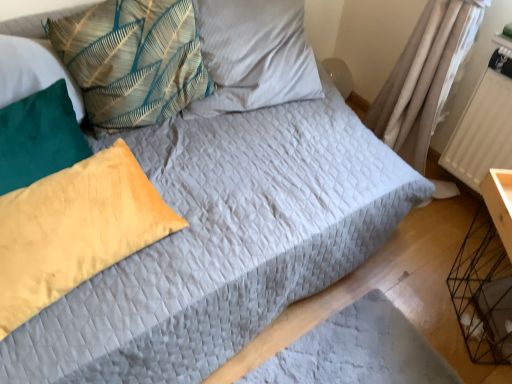
Describe the element at coordinates (482, 132) in the screenshot. The width and height of the screenshot is (512, 384). I see `white textured radiator at right` at that location.

What do you see at coordinates (39, 138) in the screenshot?
I see `yellow cotton pillow at left, positioned as the 2th pillow in bottom-to-top order` at bounding box center [39, 138].

The height and width of the screenshot is (384, 512). In order to click on white textured radiator at right in this screenshot , I will do `click(482, 132)`.

Considering the relative sizes of velvet yellow pillow at left, the 4th pillow when ordered from top to bottom, and yellow cotton pillow at left, the third pillow positioned from the top, in the image provided, is velvet yellow pillow at left, the 4th pillow when ordered from top to bottom, taller than yellow cotton pillow at left, the third pillow positioned from the top,?

In fact, velvet yellow pillow at left, the 4th pillow when ordered from top to bottom, may be shorter than yellow cotton pillow at left, the third pillow positioned from the top.

Which is farther from the camera, (6, 230) or (33, 159)?

Point (33, 159)

Considering the relative sizes of velvet yellow pillow at left, the 4th pillow when ordered from top to bottom, and yellow cotton pillow at left, positioned as the 2th pillow in bottom-to-top order, in the image provided, is velvet yellow pillow at left, the 4th pillow when ordered from top to bottom, bigger than yellow cotton pillow at left, positioned as the 2th pillow in bottom-to-top order,?

Correct, velvet yellow pillow at left, the 4th pillow when ordered from top to bottom, is larger in size than yellow cotton pillow at left, positioned as the 2th pillow in bottom-to-top order.

Does velvet yellow pillow at left, the 4th pillow when ordered from top to bottom, have a greater height compared to white textured radiator at right?

No, velvet yellow pillow at left, the 4th pillow when ordered from top to bottom, is not taller than white textured radiator at right.

Which object is thinner, velvet yellow pillow at left, the 1th pillow ordered from the bottom, or white textured radiator at right?

Thinner between the two is white textured radiator at right.

Consider the image. From a real-world perspective, is velvet yellow pillow at left, the 1th pillow ordered from the bottom, physically located above or below white textured radiator at right?

velvet yellow pillow at left, the 1th pillow ordered from the bottom, is above white textured radiator at right.

Considering their positions, is teal fabric pillow at upper left, which is counted as the 2th pillow, starting from the top, located in front of or behind white textured radiator at right?

Clearly, teal fabric pillow at upper left, which is counted as the 2th pillow, starting from the top, is in front of white textured radiator at right.

From the image's perspective, between teal fabric pillow at upper left, which is counted as the 2th pillow, starting from the top, and white textured radiator at right, who is located below?

white textured radiator at right appears lower in the image.

Does teal fabric pillow at upper left, which is counted as the 2th pillow, starting from the top, have a smaller size compared to white textured radiator at right?

No.

In the scene shown: Is teal fabric pillow at upper left, the third pillow when ordered from bottom to top, next to white textured radiator at right and touching it?

They are not placed beside each other.

Does black wire crate at lower right have a lesser width compared to velvet yellow pillow at left, the 4th pillow when ordered from top to bottom?

In fact, black wire crate at lower right might be wider than velvet yellow pillow at left, the 4th pillow when ordered from top to bottom.

From the image's perspective, which one is positioned higher, black wire crate at lower right or velvet yellow pillow at left, the 1th pillow ordered from the bottom?

velvet yellow pillow at left, the 1th pillow ordered from the bottom, appears higher in the image.

Which is more distant, (x=509, y=287) or (x=104, y=230)?

The point (x=509, y=287) is more distant.

Does black wire crate at lower right have a greater height compared to velvet yellow pillow at left, the 1th pillow ordered from the bottom?

Yes, black wire crate at lower right is taller than velvet yellow pillow at left, the 1th pillow ordered from the bottom.

Locate an element on the screen. This screenshot has height=384, width=512. the 1st pillow to the left of the textured fabric pillow at upper center, which ranks as the 4th pillow in bottom-to-top order, starting your count from the anchor is located at coordinates (132, 60).

Looking at this image, considering the relative sizes of textured fabric pillow at upper center, which ranks as the 4th pillow in bottom-to-top order, and teal fabric pillow at upper left, which is counted as the 2th pillow, starting from the top, in the image provided, is textured fabric pillow at upper center, which ranks as the 4th pillow in bottom-to-top order, bigger than teal fabric pillow at upper left, which is counted as the 2th pillow, starting from the top,?

Correct, textured fabric pillow at upper center, which ranks as the 4th pillow in bottom-to-top order, is larger in size than teal fabric pillow at upper left, which is counted as the 2th pillow, starting from the top.

From the picture: Would you say teal fabric pillow at upper left, which is counted as the 2th pillow, starting from the top, is part of textured fabric pillow at upper center, which ranks as the 4th pillow in bottom-to-top order,'s contents?

No, textured fabric pillow at upper center, which ranks as the 4th pillow in bottom-to-top order, does not contain teal fabric pillow at upper left, which is counted as the 2th pillow, starting from the top.

Who is more distant, textured fabric pillow at upper center, the first pillow from the top, or teal fabric pillow at upper left, which is counted as the 2th pillow, starting from the top?

textured fabric pillow at upper center, the first pillow from the top, is more distant.

Would you say white textured radiator at right is inside or outside textured fabric pillow at upper center, which ranks as the 4th pillow in bottom-to-top order?

The correct answer is: outside.

Could you tell me if white textured radiator at right is facing textured fabric pillow at upper center, which ranks as the 4th pillow in bottom-to-top order?

No, white textured radiator at right does not turn towards textured fabric pillow at upper center, which ranks as the 4th pillow in bottom-to-top order.

Considering the relative sizes of white textured radiator at right and textured fabric pillow at upper center, the first pillow from the top, in the image provided, is white textured radiator at right thinner than textured fabric pillow at upper center, the first pillow from the top,?

Correct, the width of white textured radiator at right is less than that of textured fabric pillow at upper center, the first pillow from the top.

How different are the orientations of white textured radiator at right and textured fabric pillow at upper center, the first pillow from the top, in degrees?

They differ by 93.7 degrees in their facing directions.

Are white textured radiator at right and teal fabric pillow at upper left, the third pillow when ordered from bottom to top, far apart?

Absolutely, white textured radiator at right is distant from teal fabric pillow at upper left, the third pillow when ordered from bottom to top.

Can you tell me how much white textured radiator at right and teal fabric pillow at upper left, which is counted as the 2th pillow, starting from the top, differ in facing direction?

There is a 97.1-degree angle between the facing directions of white textured radiator at right and teal fabric pillow at upper left, which is counted as the 2th pillow, starting from the top.

Between white textured radiator at right and teal fabric pillow at upper left, which is counted as the 2th pillow, starting from the top, which one has more height?

Answer: Standing taller between the two is white textured radiator at right.

Considering the relative positions of white textured radiator at right and teal fabric pillow at upper left, the third pillow when ordered from bottom to top, in the image provided, is white textured radiator at right to the left of teal fabric pillow at upper left, the third pillow when ordered from bottom to top, from the viewer's perspective?

In fact, white textured radiator at right is to the right of teal fabric pillow at upper left, the third pillow when ordered from bottom to top.

The width and height of the screenshot is (512, 384). Identify the location of pillow that is the 1st one when counting rightward from the yellow cotton pillow at left, the third pillow positioned from the top. (75, 229).

The height and width of the screenshot is (384, 512). In the image, there is a velvet yellow pillow at left, the 4th pillow when ordered from top to bottom. What are the coordinates of `radiator below it (from a real-world perspective)` in the screenshot? It's located at 482,132.

Considering their positions, is yellow cotton pillow at left, the third pillow positioned from the top, positioned further to teal fabric pillow at upper left, which is counted as the 2th pillow, starting from the top, than black wire crate at lower right?

black wire crate at lower right.

Based on their spatial positions, is velvet yellow pillow at left, the 4th pillow when ordered from top to bottom, or textured fabric pillow at upper center, which ranks as the 4th pillow in bottom-to-top order, further from teal fabric pillow at upper left, the third pillow when ordered from bottom to top?

Among the two, velvet yellow pillow at left, the 4th pillow when ordered from top to bottom, is located further to teal fabric pillow at upper left, the third pillow when ordered from bottom to top.

Estimate the real-world distances between objects in this image. Which object is closer to white textured radiator at right, yellow cotton pillow at left, the third pillow positioned from the top, or teal fabric pillow at upper left, the third pillow when ordered from bottom to top?

Among the two, teal fabric pillow at upper left, the third pillow when ordered from bottom to top, is located nearer to white textured radiator at right.

Considering their positions, is teal fabric pillow at upper left, the third pillow when ordered from bottom to top, positioned closer to white textured radiator at right than textured fabric pillow at upper center, the first pillow from the top?

textured fabric pillow at upper center, the first pillow from the top, lies closer to white textured radiator at right than the other object.

Considering their positions, is yellow cotton pillow at left, positioned as the 2th pillow in bottom-to-top order, positioned closer to teal fabric pillow at upper left, the third pillow when ordered from bottom to top, than velvet yellow pillow at left, the 4th pillow when ordered from top to bottom?

Based on the image, yellow cotton pillow at left, positioned as the 2th pillow in bottom-to-top order, appears to be nearer to teal fabric pillow at upper left, the third pillow when ordered from bottom to top.

Estimate the real-world distances between objects in this image. Which object is further from black wire crate at lower right, yellow cotton pillow at left, the third pillow positioned from the top, or teal fabric pillow at upper left, which is counted as the 2th pillow, starting from the top?

Based on the image, yellow cotton pillow at left, the third pillow positioned from the top, appears to be further to black wire crate at lower right.

Looking at this image, from the image, which object appears to be nearer to textured fabric pillow at upper center, which ranks as the 4th pillow in bottom-to-top order, yellow cotton pillow at left, positioned as the 2th pillow in bottom-to-top order, or white textured radiator at right?

yellow cotton pillow at left, positioned as the 2th pillow in bottom-to-top order, is closer to textured fabric pillow at upper center, which ranks as the 4th pillow in bottom-to-top order.

Looking at the image, which one is located further to textured fabric pillow at upper center, the first pillow from the top, teal fabric pillow at upper left, the third pillow when ordered from bottom to top, or white textured radiator at right?

white textured radiator at right is positioned further to the anchor textured fabric pillow at upper center, the first pillow from the top.

The width and height of the screenshot is (512, 384). Identify the location of crate between yellow cotton pillow at left, positioned as the 2th pillow in bottom-to-top order, and white textured radiator at right, in the horizontal direction. (483, 292).

Where is `pillow between teal fabric pillow at upper left, the third pillow when ordered from bottom to top, and white textured radiator at right from left to right`? pillow between teal fabric pillow at upper left, the third pillow when ordered from bottom to top, and white textured radiator at right from left to right is located at coordinates (253, 55).

Identify the location of crate between teal fabric pillow at upper left, which is counted as the 2th pillow, starting from the top, and white textured radiator at right. (483, 292).

Identify the location of crate between textured fabric pillow at upper center, the first pillow from the top, and white textured radiator at right, in the horizontal direction. The image size is (512, 384). (483, 292).